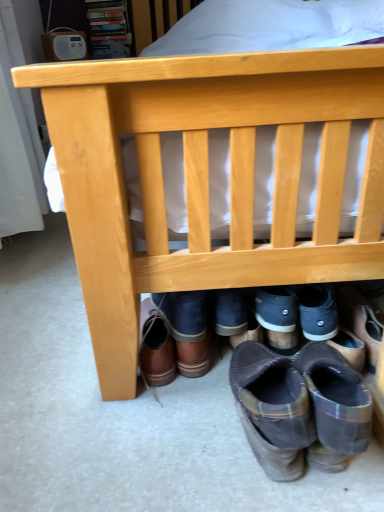
Question: Considering the relative positions of brown leather boots at lower center, positioned as the third footwear in left-to-right order, and dark gray suede boot at center, acting as the fourth footwear starting from the left, in the image provided, is brown leather boots at lower center, positioned as the third footwear in left-to-right order, to the left or to the right of dark gray suede boot at center, acting as the fourth footwear starting from the left,?

Choices:
 (A) right
 (B) left

Answer: (B)

Question: In terms of height, does brown leather boots at lower center, placed as the 2th footwear when sorted from right to left, look taller or shorter compared to dark gray suede boot at center, placed as the first footwear when sorted from right to left?

Choices:
 (A) short
 (B) tall

Answer: (B)

Question: Based on their relative distances, which object is farther from the brown leather boots at lower center, which appears as the 2th footwear when viewed from the left?

Choices:
 (A) brown leather boots at lower center, positioned as the third footwear in left-to-right order
 (B) brown leather boot at lower center, acting as the fourth footwear starting from the right
 (C) brown suede boot at lower right
 (D) dark gray suede boot at center, placed as the first footwear when sorted from right to left

Answer: (C)

Question: Which is farther from the dark gray suede boot at center, placed as the first footwear when sorted from right to left?

Choices:
 (A) brown leather boots at lower center, placed as the 2th footwear when sorted from right to left
 (B) brown suede boot at lower right
 (C) brown leather boots at lower center, which appears as the 2th footwear when viewed from the left
 (D) brown leather boot at lower center, acting as the fourth footwear starting from the right

Answer: (D)